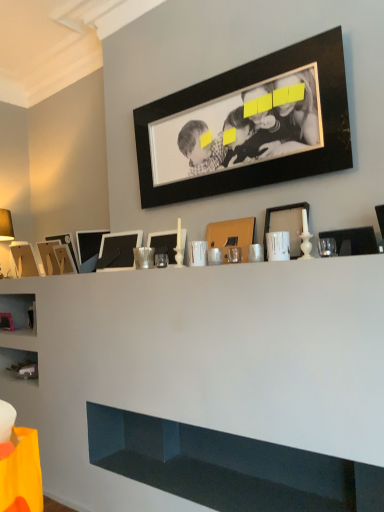
Question: Is wooden picture frame at left, positioned as the 2th picture frame in left-to-right order, shorter than matte white picture frame at center, which is the second picture frame from right to left?

Choices:
 (A) no
 (B) yes

Answer: (A)

Question: Is wooden picture frame at left, positioned as the 2th picture frame in left-to-right order, not close to matte white picture frame at center, which is the second picture frame from right to left?

Choices:
 (A) yes
 (B) no

Answer: (A)

Question: Is wooden picture frame at left, positioned as the 2th picture frame in left-to-right order, outside matte white picture frame at center, which is the second picture frame from right to left?

Choices:
 (A) yes
 (B) no

Answer: (A)

Question: Is wooden picture frame at left, positioned as the 2th picture frame in left-to-right order, positioned behind matte white picture frame at center, which is the second picture frame from right to left?

Choices:
 (A) no
 (B) yes

Answer: (B)

Question: From the image's perspective, is wooden picture frame at left, positioned as the 2th picture frame in left-to-right order, over matte white picture frame at center, which is the second picture frame from right to left?

Choices:
 (A) no
 (B) yes

Answer: (A)

Question: Based on their sizes in the image, would you say matte black picture frame at right, marked as the tenth picture frame in a left-to-right arrangement, is bigger or smaller than matte cardboard picture frame at left, the 1th picture frame in the left-to-right sequence?

Choices:
 (A) big
 (B) small

Answer: (B)

Question: In terms of width, does matte black picture frame at right, marked as the tenth picture frame in a left-to-right arrangement, look wider or thinner when compared to matte cardboard picture frame at left, the 1th picture frame in the left-to-right sequence?

Choices:
 (A) wide
 (B) thin

Answer: (B)

Question: Is point (336, 234) closer or farther from the camera than point (11, 254)?

Choices:
 (A) closer
 (B) farther

Answer: (A)

Question: Is matte black picture frame at right, marked as the tenth picture frame in a left-to-right arrangement, taller or shorter than matte cardboard picture frame at left, the 1th picture frame in the left-to-right sequence?

Choices:
 (A) tall
 (B) short

Answer: (B)

Question: Is point (52, 265) closer or farther from the camera than point (77, 250)?

Choices:
 (A) closer
 (B) farther

Answer: (B)

Question: Is wooden picture frame at left, positioned as the 2th picture frame in left-to-right order, bigger or smaller than matte black picture frame at left, placed as the seventh picture frame when sorted from right to left?

Choices:
 (A) big
 (B) small

Answer: (A)

Question: Is wooden picture frame at left, acting as the ninth picture frame starting from the right, wider or thinner than matte black picture frame at left, placed as the seventh picture frame when sorted from right to left?

Choices:
 (A) wide
 (B) thin

Answer: (A)

Question: Considering the positions of wooden picture frame at left, positioned as the 2th picture frame in left-to-right order, and matte black picture frame at left, which is the 4th picture frame from left to right, in the image, is wooden picture frame at left, positioned as the 2th picture frame in left-to-right order, taller or shorter than matte black picture frame at left, which is the 4th picture frame from left to right,?

Choices:
 (A) tall
 (B) short

Answer: (B)

Question: Is point (248, 227) closer or farther from the camera than point (249, 470)?

Choices:
 (A) farther
 (B) closer

Answer: (B)

Question: From the image's perspective, is matte brown picture frame at center, the 3th picture frame viewed from the right, above or below white glossy cabinet at lower center?

Choices:
 (A) above
 (B) below

Answer: (A)